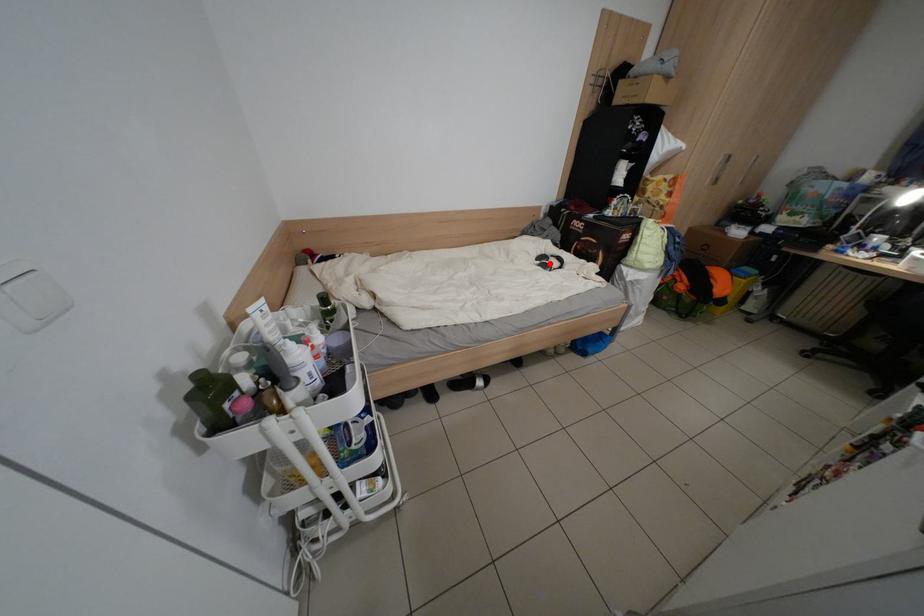
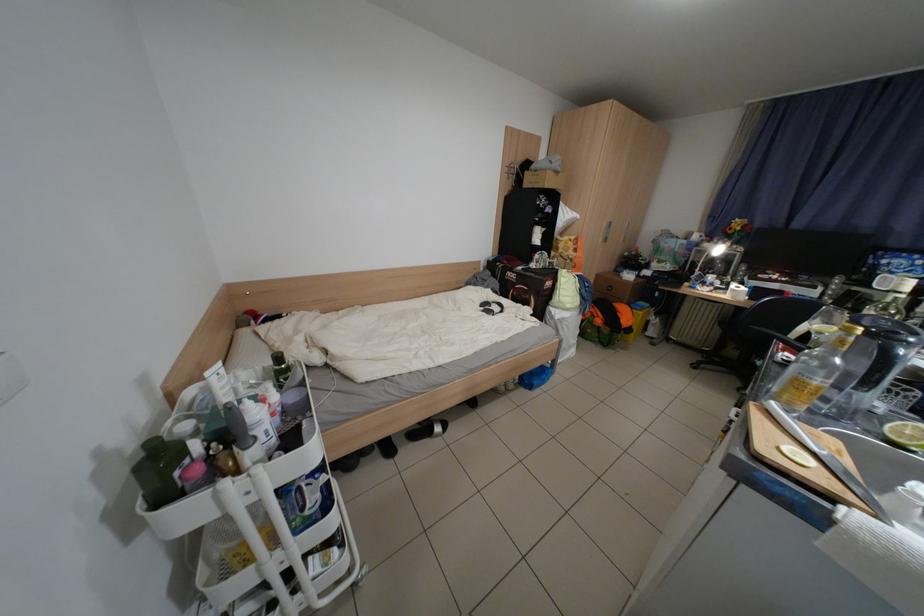
The point at the highlighted location is marked in the first image. Where is the corresponding point in the second image?

(493, 310)